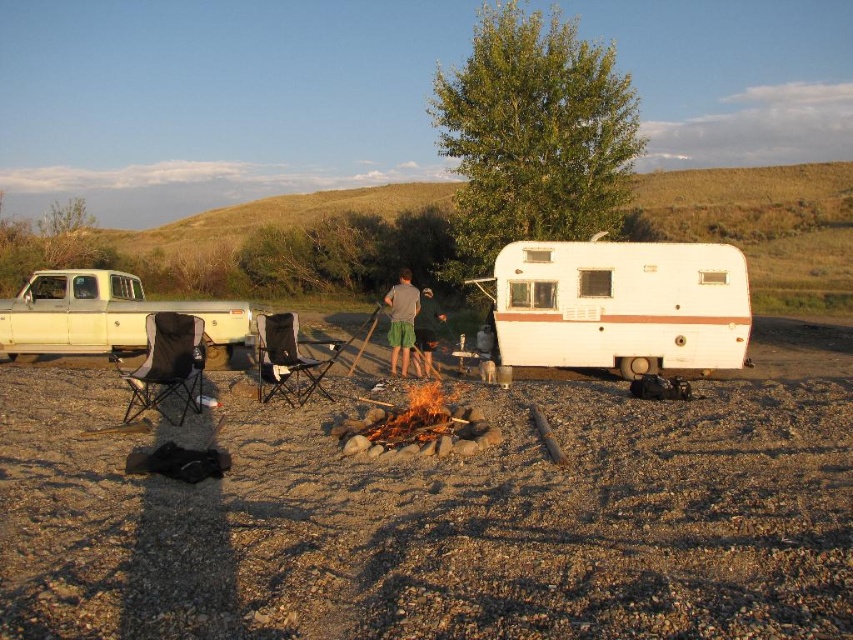
You are a hiker who needs to set up a tent. You have two options for the ground surface to place it on. Which surface would be more stable for the tent base, the dirt gravel at center or the matte white truck at left?

The dirt gravel at center is located below matte white truck at left, so the dirt gravel at center would be a more stable surface for the tent base since it is on the ground, while the matte white truck at left is elevated and might not provide a solid foundation.

You are planning to set up a tent in the camping scene. The white matte camper at center and the dark gray fabric pants at center are in your way. Which object should you move first to clear the path?

You should move the dark gray fabric pants at center first because the white matte camper at center is positioned under it, so moving the pants will allow access to the camper.